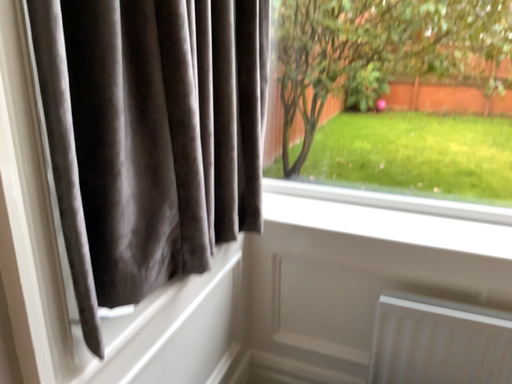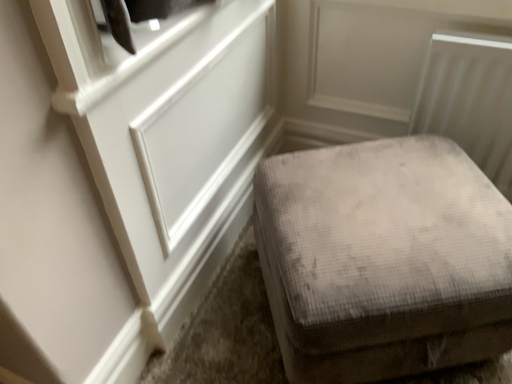
Question: Which way did the camera rotate in the video?

Choices:
 (A) rotated downward
 (B) rotated upward

Answer: (A)